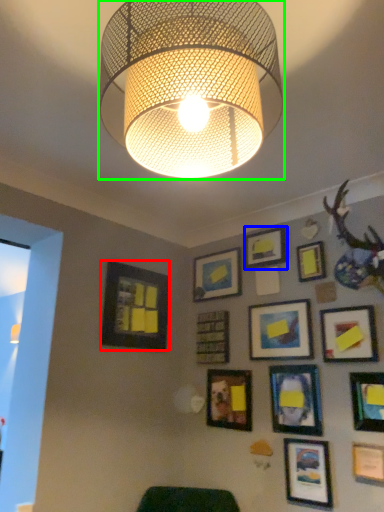
Question: Based on their relative distances, which object is nearer to picture frame (highlighted by a red box)? Choose from picture frame (highlighted by a blue box) and lamp (highlighted by a green box).

Choices:
 (A) picture frame
 (B) lamp

Answer: (A)